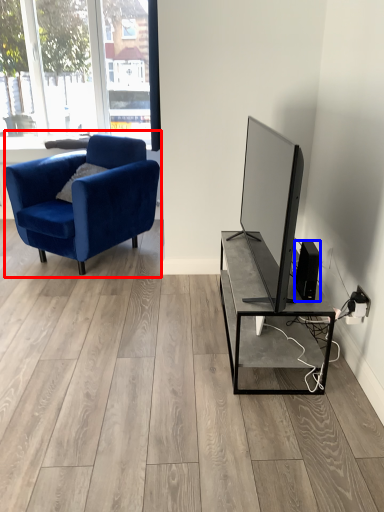
Question: Which point is further to the camera, chair (highlighted by a red box) or speaker (highlighted by a blue box)?

Choices:
 (A) chair
 (B) speaker

Answer: (A)